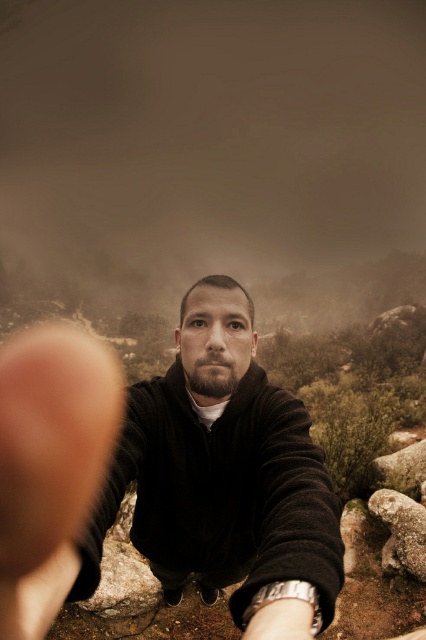
Question: Does black matte jacket at center have a lesser width compared to rough textured rock at lower right?

Choices:
 (A) no
 (B) yes

Answer: (A)

Question: Is black matte jacket at center bigger than rough textured rock at lower right?

Choices:
 (A) yes
 (B) no

Answer: (A)

Question: Does black matte jacket at center appear under rough textured rock at lower right?

Choices:
 (A) yes
 (B) no

Answer: (B)

Question: Among these points, which one is farthest from the camera?

Choices:
 (A) (394, 493)
 (B) (158, 522)

Answer: (A)

Question: Which point is farther to the camera?

Choices:
 (A) (325, 548)
 (B) (412, 556)

Answer: (B)

Question: Which object is closer to the camera taking this photo?

Choices:
 (A) rough textured rock at lower right
 (B) black matte jacket at center

Answer: (B)